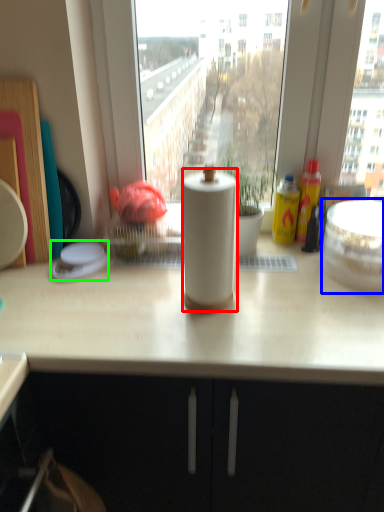
Question: Which object is positioned closest to paper towel (highlighted by a red box)? Select from appliance (highlighted by a blue box) and appliance (highlighted by a green box).

Choices:
 (A) appliance
 (B) appliance

Answer: (A)